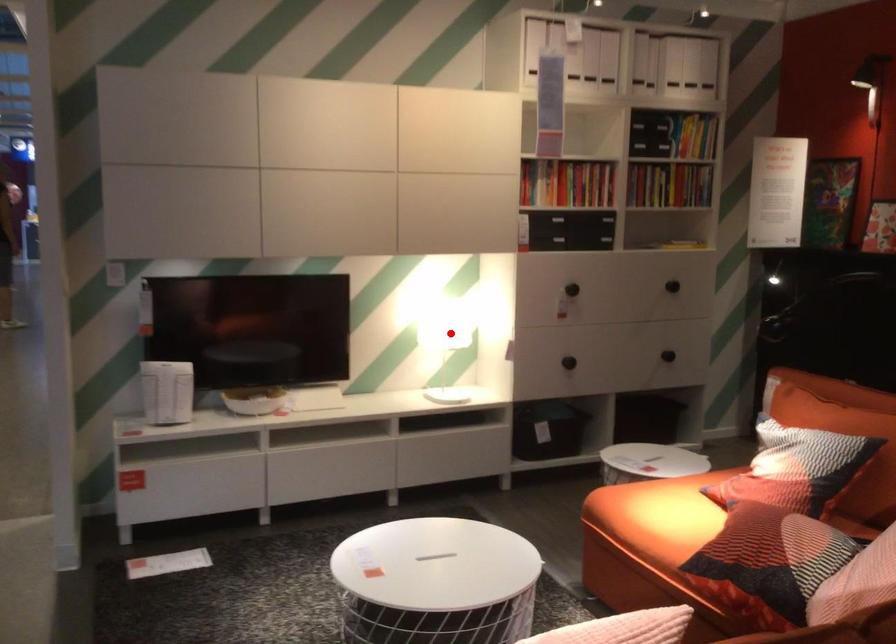
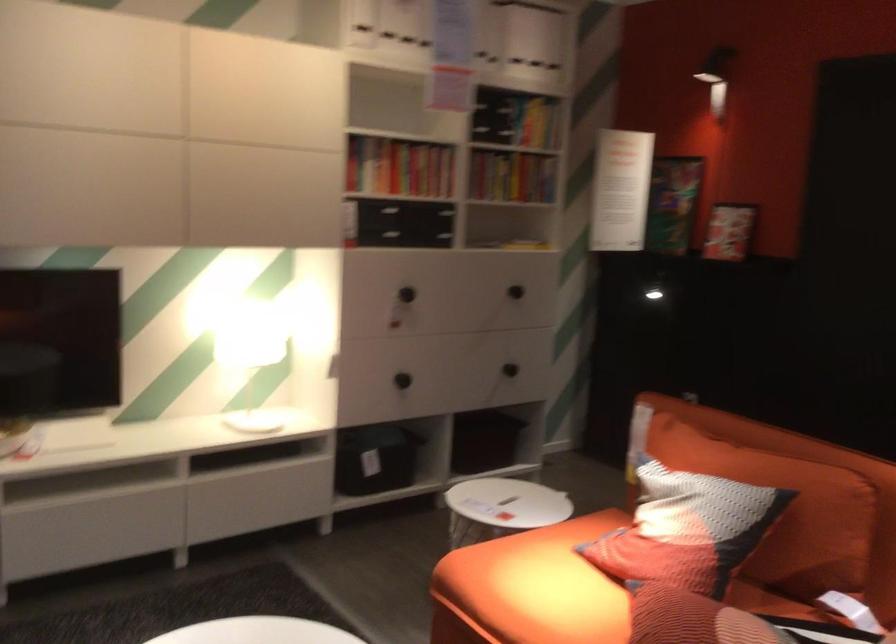
Where in the second image is the point corresponding to the highlighted location from the first image?

(250, 354)